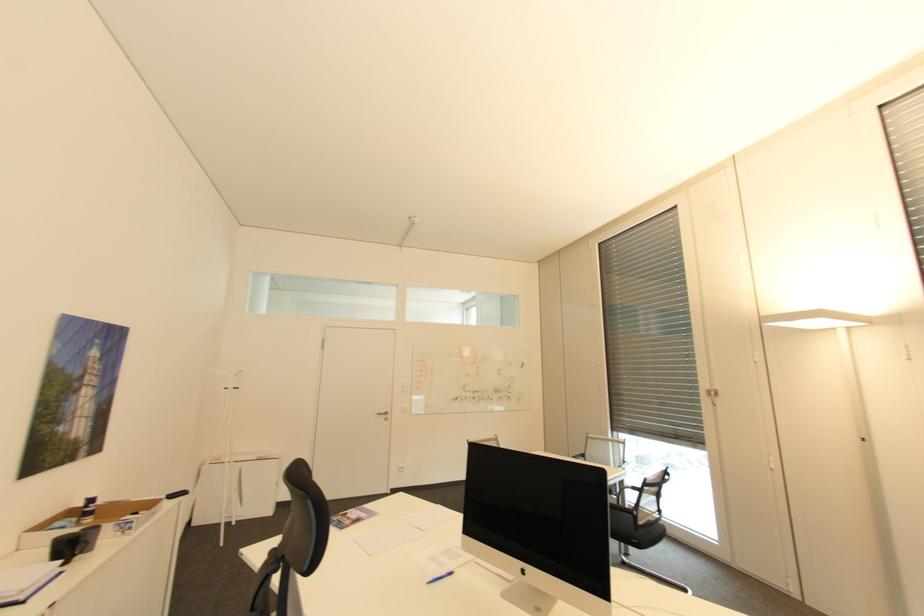
Find the location of a particular element. This screenshot has width=924, height=616. silver door handle is located at coordinates tap(383, 416).